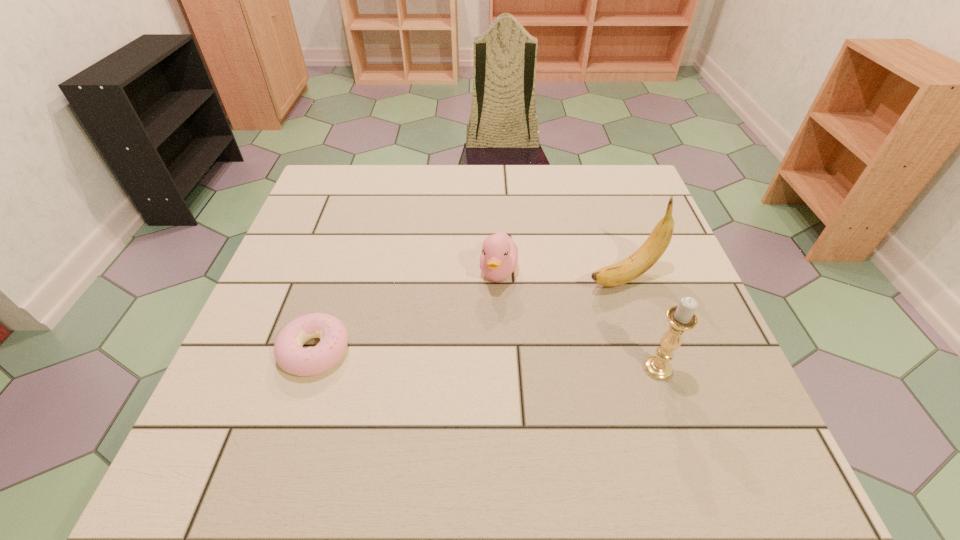
The image size is (960, 540). In order to click on empty location between the candle holder and the doughnut in this screenshot , I will do `click(486, 359)`.

Find the location of a particular element. The width and height of the screenshot is (960, 540). unoccupied area between the duckling and the candle holder is located at coordinates (578, 320).

Select which object appears as the third closest to the duckling. Please provide its 2D coordinates. Your answer should be formatted as a tuple, i.e. [(x, y)], where the tuple contains the x and y coordinates of a point satisfying the conditions above.

[(681, 318)]

The height and width of the screenshot is (540, 960). I want to click on the third closest object relative to the shortest object, so click(681, 318).

The width and height of the screenshot is (960, 540). What are the coordinates of `vacant position in the image that satisfies the following two spatial constraints: 1. on the back side of the shortest object; 2. on the left side of the banana` in the screenshot? It's located at (339, 276).

This screenshot has height=540, width=960. Find the location of `vacant space that satisfies the following two spatial constraints: 1. on the front side of the doughnut; 2. on the left side of the candle holder`. vacant space that satisfies the following two spatial constraints: 1. on the front side of the doughnut; 2. on the left side of the candle holder is located at coordinates (309, 368).

Identify the location of vacant area that satisfies the following two spatial constraints: 1. on the back side of the doughnut; 2. on the right side of the duckling. This screenshot has height=540, width=960. (340, 272).